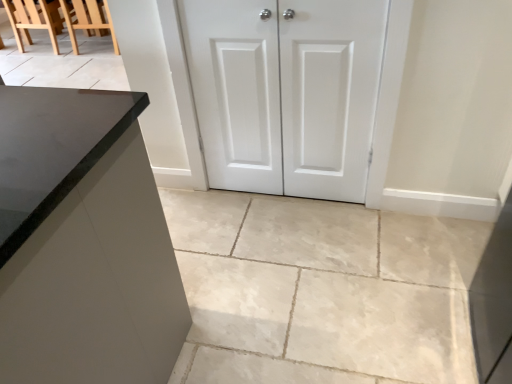
Question: From their relative heights in the image, would you say slate gray stone countertop at left is taller or shorter than white matte cabinet doors at center?

Choices:
 (A) tall
 (B) short

Answer: (B)

Question: From the image's perspective, is slate gray stone countertop at left above or below white matte cabinet doors at center?

Choices:
 (A) below
 (B) above

Answer: (A)

Question: Which object is positioned closest to the wooden chair at upper left, acting as the first chair starting from the left?

Choices:
 (A) wooden chair at upper left, arranged as the 2th chair when viewed from the left
 (B) white matte cabinet doors at center
 (C) slate gray stone countertop at left
 (D) white matte cabinet doors at center

Answer: (A)

Question: Based on their relative distances, which object is farther from the slate gray stone countertop at left?

Choices:
 (A) white matte cabinet doors at center
 (B) white matte cabinet doors at center
 (C) wooden chair at upper left, which is counted as the 2th chair, starting from the right
 (D) wooden chair at upper left, arranged as the 2th chair when viewed from the left

Answer: (C)